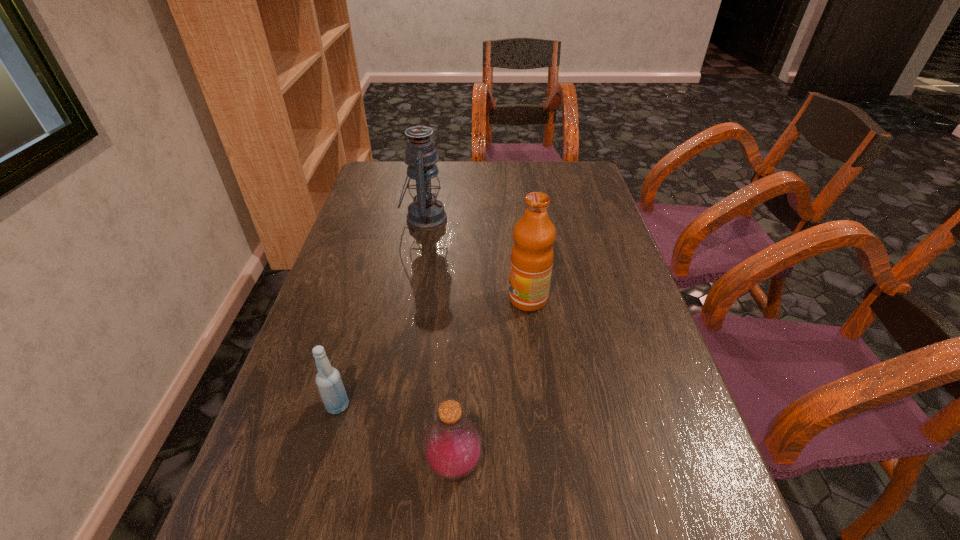
Select which object appears as the closest to the right bottle. Please provide its 2D coordinates. Your answer should be formatted as a tuple, i.e. [(x, y)], where the tuple contains the x and y coordinates of a point satisfying the conditions above.

[(328, 379)]

Locate an element on the screen. The width and height of the screenshot is (960, 540). free spot that satisfies the following two spatial constraints: 1. on the front-facing side of the right bottle; 2. on the left side of the third object from right to left is located at coordinates (383, 465).

Identify the location of free space that satisfies the following two spatial constraints: 1. on the front-facing side of the second object from left to right; 2. on the left side of the nearest object. The width and height of the screenshot is (960, 540). (383, 465).